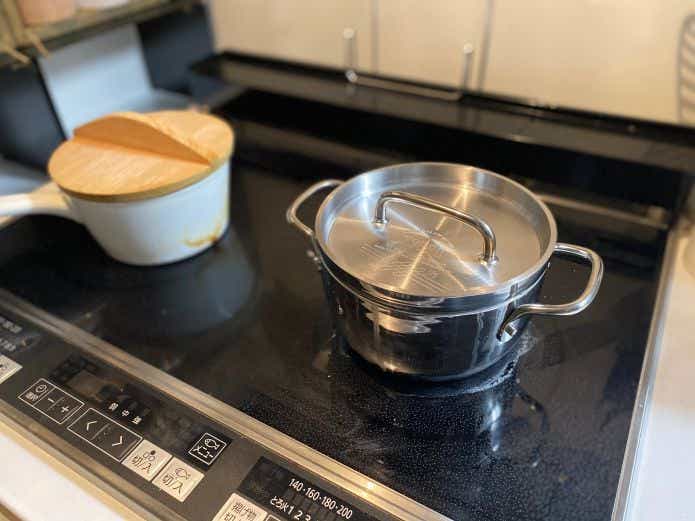
Find the location of `stove top`. stove top is located at coordinates (254, 386).